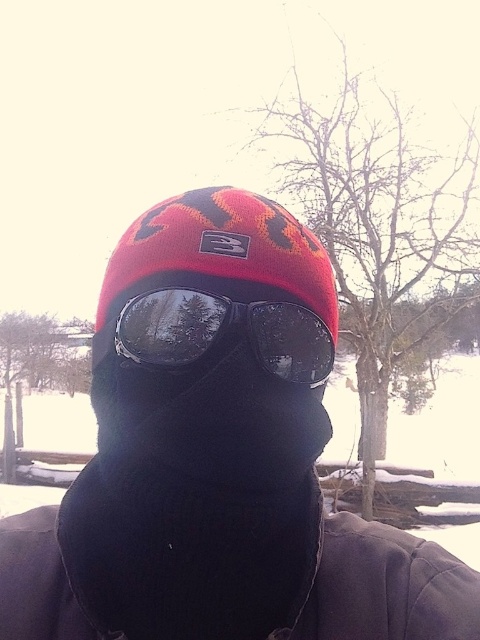
Between matte black ski mask at center and glossy plastic goggles at center, which one is positioned lower?

matte black ski mask at center is lower down.

Which of these two, matte black ski mask at center or glossy plastic goggles at center, stands shorter?

glossy plastic goggles at center

Locate an element on the screen. Image resolution: width=480 pixels, height=640 pixels. matte black ski mask at center is located at coordinates (218, 458).